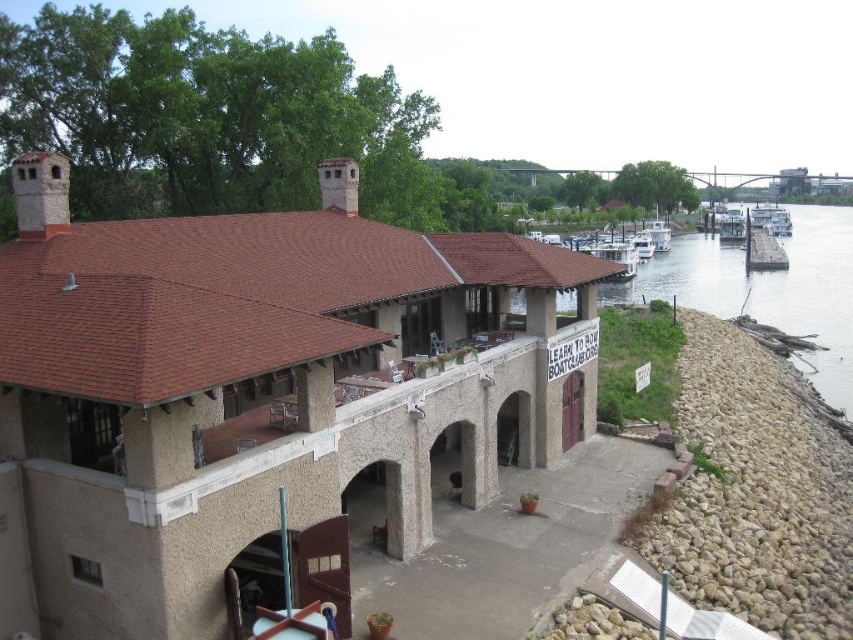
You are standing on the smooth wooden dock at right and want to see the white glossy boat at lower center. In which direction should you look to see it?

The smooth wooden dock at right is located above the white glossy boat at lower center, so you should look downward to see it.

You are standing on the riverbank and want to walk to the white wooden boat at center right. There is a smooth concrete water at right in your path. Which direction should you move to avoid stepping into the water?

To avoid stepping into the smooth concrete water at right, you should move to the right side of the white wooden boat at center right since the water is located to the left of the boat.